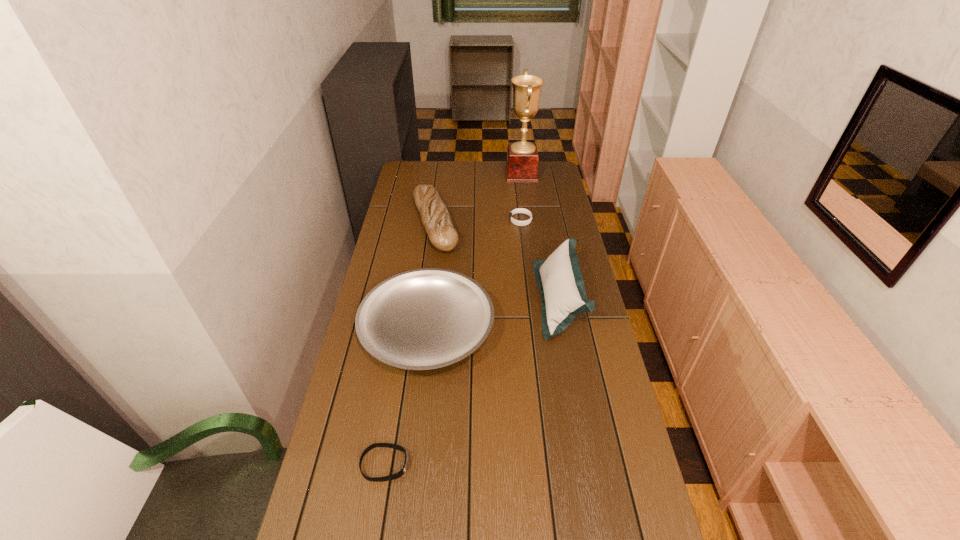
I want to click on vacant position located on the plaque of the farthest object, so click(x=466, y=174).

Where is `vacant space located 0.060m on the plaque of the farthest object`? The height and width of the screenshot is (540, 960). vacant space located 0.060m on the plaque of the farthest object is located at coordinates (493, 174).

Find the location of a particular element. The width and height of the screenshot is (960, 540). vacant space located on the surface of the cushion is located at coordinates click(512, 300).

This screenshot has width=960, height=540. Identify the location of vacant point located on the surface of the cushion. (463, 300).

The image size is (960, 540). In order to click on vacant point located on the surface of the cushion in this screenshot , I will do `click(448, 300)`.

The image size is (960, 540). I want to click on blank space located on the left of the baguet, so click(391, 224).

Locate an element on the screen. The height and width of the screenshot is (540, 960). free space located 0.170m on the front of the bedpan is located at coordinates (415, 444).

Locate an element on the screen. This screenshot has width=960, height=540. free space located on the outer surface of the taller wristband is located at coordinates (438, 220).

What are the coordinates of `free location located on the outer surface of the taller wristband` in the screenshot? It's located at (451, 220).

This screenshot has width=960, height=540. Find the location of `vacant area situated on the outer surface of the taller wristband`. vacant area situated on the outer surface of the taller wristband is located at coordinates (489, 220).